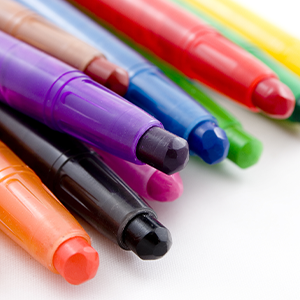
This screenshot has width=300, height=300. What are the coordinates of `marker` in the screenshot? It's located at (41, 215), (99, 188), (98, 119), (74, 58), (128, 56), (137, 177), (223, 116), (216, 61), (253, 51), (279, 40).